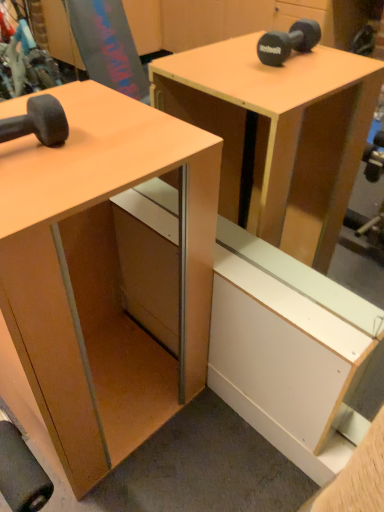
What are the coordinates of `vacant space in front of matte black dumbbell at left` in the screenshot? It's located at (23, 192).